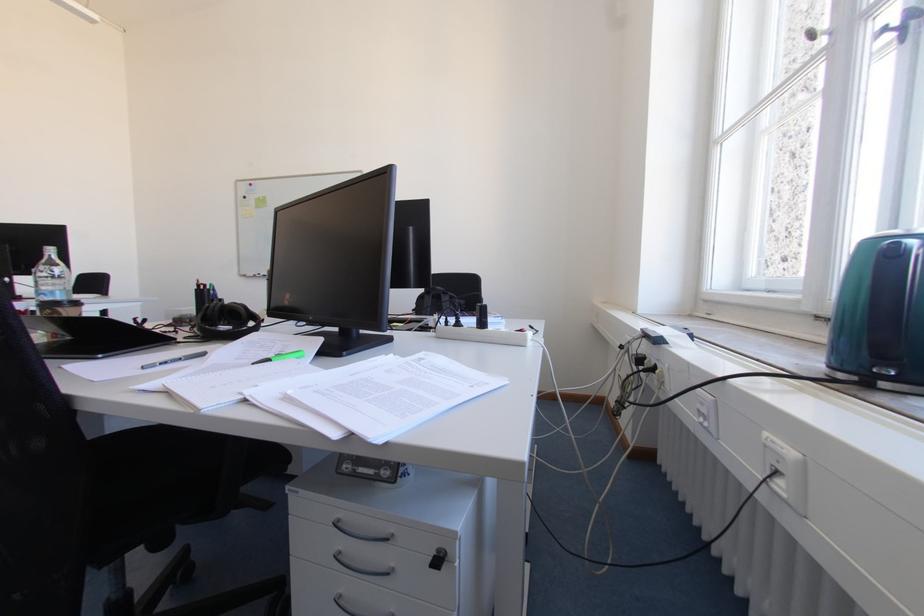
This screenshot has width=924, height=616. Find the location of `green kettle handle`. green kettle handle is located at coordinates (893, 309).